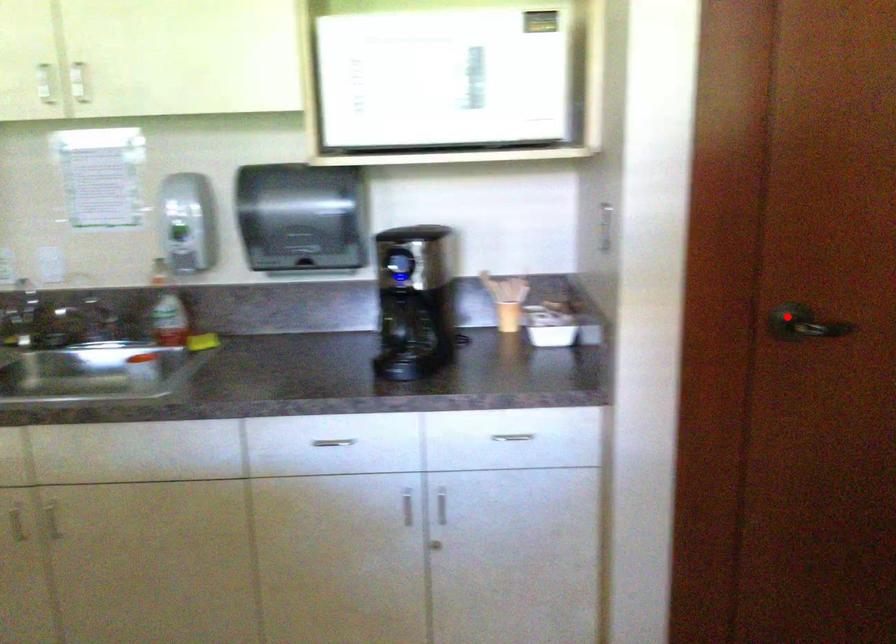
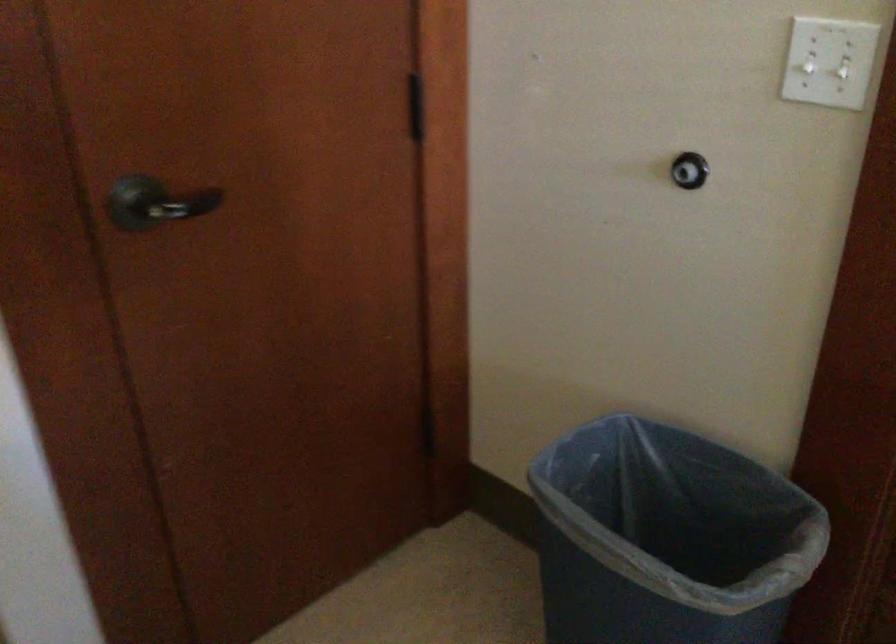
Find the pixel in the second image that matches the highlighted location in the first image.

(156, 203)